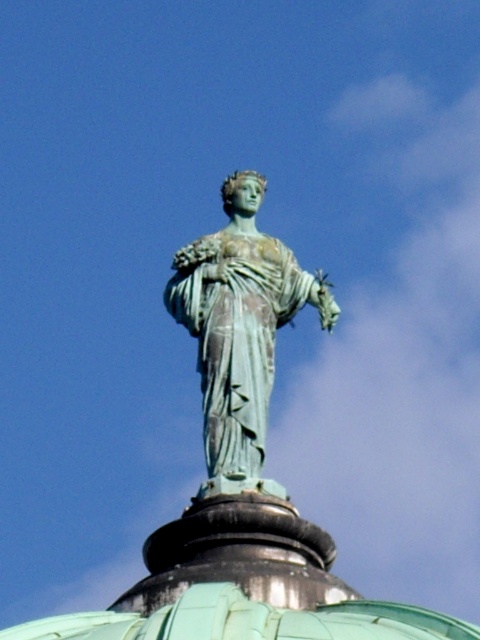
You are a maintenance worker needing to inspect both the green patina statue at center and the green copper dome at center. Given that your ladder is 15 meters long, can you reach both objects from the ground without moving the ladder?

The distance between the green patina statue at center and the green copper dome at center is 16.81 meters. Since your ladder is only 15 meters long, it cannot reach both objects simultaneously without moving the ladder.